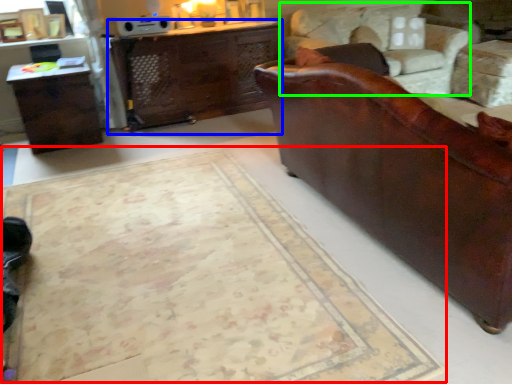
Question: Which object is positioned closest to mat (highlighted by a red box)? Select from desk (highlighted by a blue box) and swivel chair (highlighted by a green box).

Choices:
 (A) desk
 (B) swivel chair

Answer: (A)